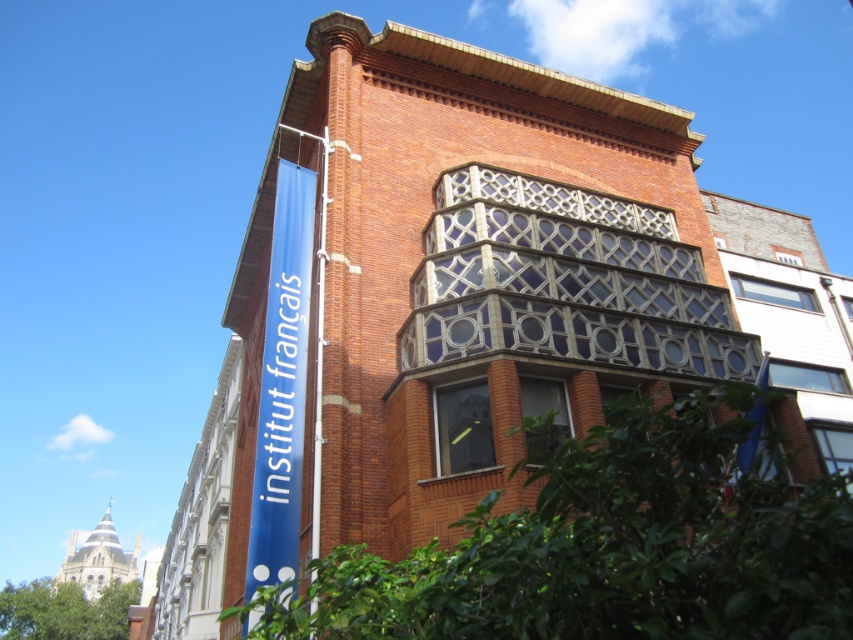
Question: Considering the relative positions of clear glass balcony at center and metallic silver pole at upper center in the image provided, where is clear glass balcony at center located with respect to metallic silver pole at upper center?

Choices:
 (A) below
 (B) above

Answer: (B)

Question: Can you confirm if clear glass balcony at center is positioned to the right of blue fabric sign at left?

Choices:
 (A) yes
 (B) no

Answer: (A)

Question: Is clear glass balcony at center positioned before blue fabric sign at left?

Choices:
 (A) no
 (B) yes

Answer: (A)

Question: Among these points, which one is farthest from the camera?

Choices:
 (A) (618, 266)
 (B) (328, 198)

Answer: (B)

Question: Which is farther from the blue fabric sign at left?

Choices:
 (A) metallic silver pole at upper center
 (B) clear glass balcony at center

Answer: (B)

Question: Among these objects, which one is nearest to the camera?

Choices:
 (A) blue fabric sign at left
 (B) clear glass balcony at center

Answer: (A)